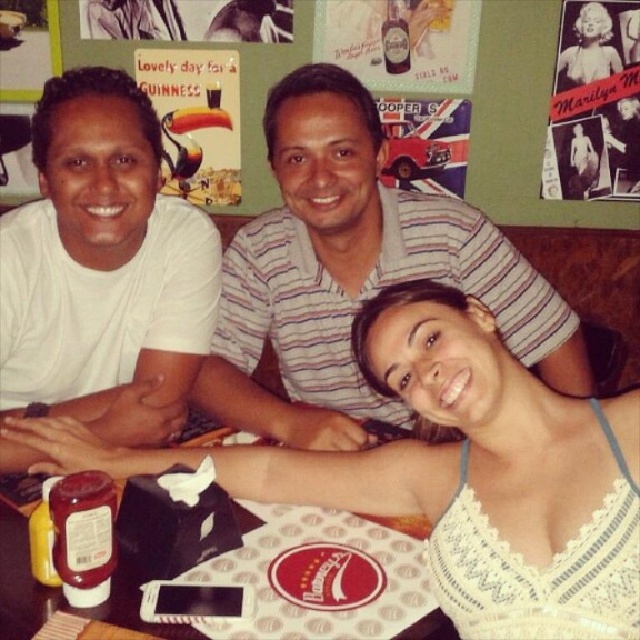
You are a photographer trying to capture a candid shot of the white striped shirt at center without including the white matte shirt at upper left in the frame. Is it possible to do so based on their positions?

The white matte shirt at upper left is behind the white striped shirt at center, so yes, it is possible to capture the white striped shirt at center without including the white matte shirt at upper left by focusing on the front of the striped shirt.

You are a photographer trying to capture a candid shot of the group. You notice the white lace tank top at center and the vintage paper marilyn monroe poster at upper right in your viewfinder. Which object would appear bigger in the photo?

The white lace tank top at center would appear bigger in the photo because it is larger in size than the vintage paper marilyn monroe poster at upper right.